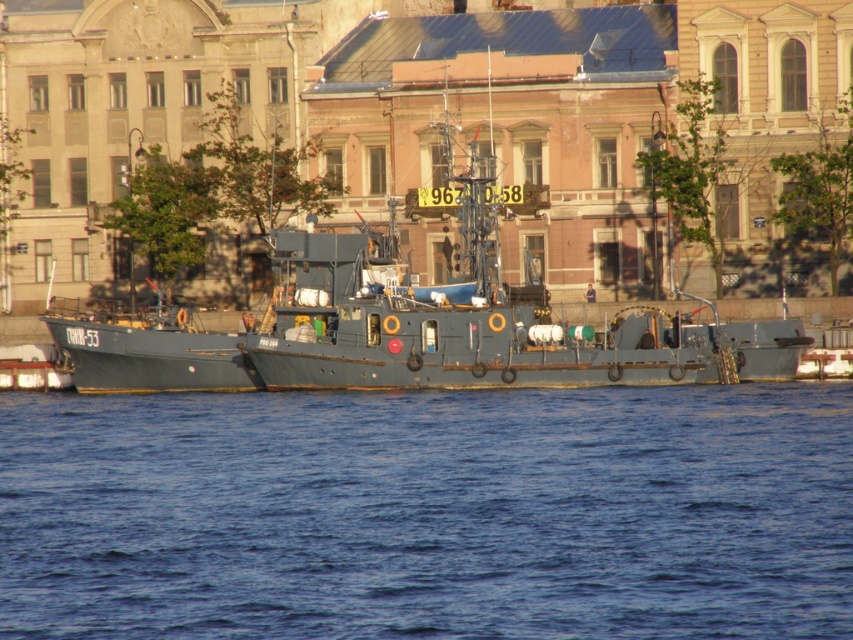
Question: Does blue water at center appear on the left side of matte gray boat at center?

Choices:
 (A) yes
 (B) no

Answer: (A)

Question: Is blue water at center to the right of matte gray boat at center from the viewer's perspective?

Choices:
 (A) no
 (B) yes

Answer: (A)

Question: Which point appears farthest from the camera in this image?

Choices:
 (A) (671, 378)
 (B) (780, 582)

Answer: (A)

Question: Which of the following is the farthest from the observer?

Choices:
 (A) (85, 528)
 (B) (527, 384)

Answer: (B)

Question: Which point is closer to the camera taking this photo?

Choices:
 (A) (482, 593)
 (B) (378, 282)

Answer: (A)

Question: Does blue water at center appear over matte gray boat at center?

Choices:
 (A) no
 (B) yes

Answer: (A)